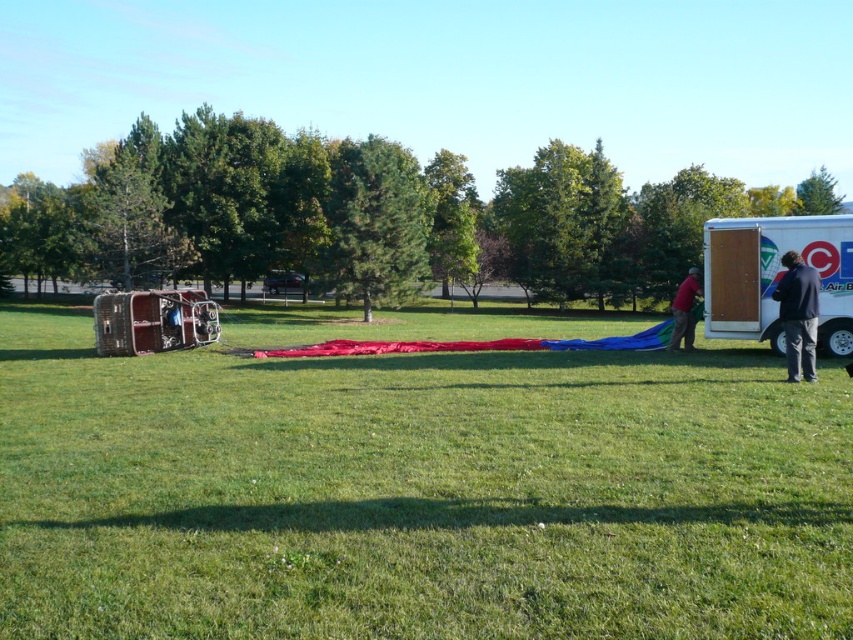
How far apart are green grassy field at center and white cardboard trailer at right?

green grassy field at center and white cardboard trailer at right are 20.94 feet apart.

Measure the distance between green grassy field at center and camera.

green grassy field at center and camera are 13.81 feet apart from each other.

Describe the element at coordinates (416, 492) in the screenshot. I see `green grassy field at center` at that location.

Find the location of `green grassy field at center`. green grassy field at center is located at coordinates (416, 492).

Is green grassy field at center taller than red fabric balloon at right?

No, green grassy field at center is not taller than red fabric balloon at right.

Who is shorter, green grassy field at center or red fabric balloon at right?

With less height is green grassy field at center.

The height and width of the screenshot is (640, 853). What are the coordinates of `green grassy field at center` in the screenshot? It's located at (416, 492).

The width and height of the screenshot is (853, 640). Describe the element at coordinates (798, 316) in the screenshot. I see `dark blue jacket at right` at that location.

Is point (787, 344) positioned in front of point (683, 333)?

That is True.

Locate an element on the screen. The width and height of the screenshot is (853, 640). dark blue jacket at right is located at coordinates (798, 316).